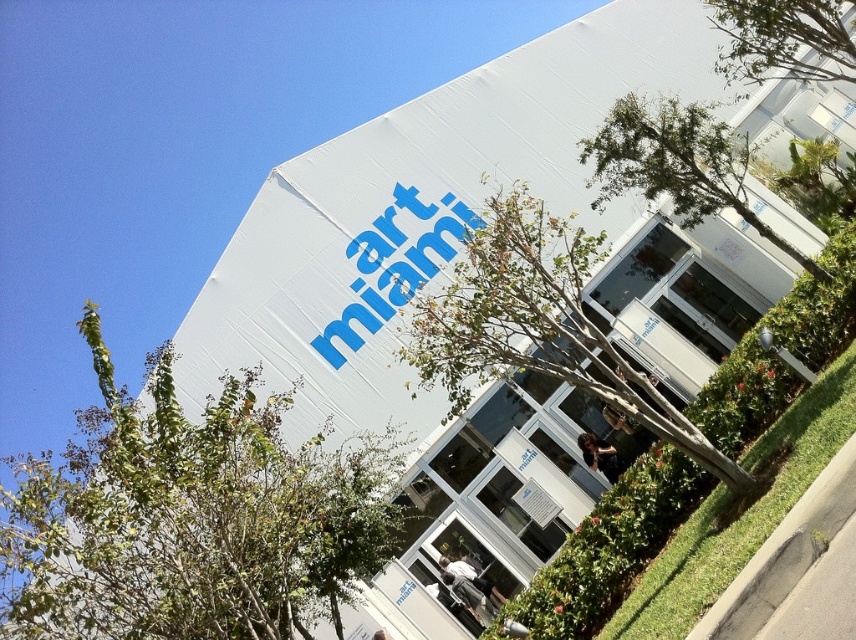
You are standing in front of the Art Miami building and want to take a photo of the point marked at coordinates point [684,214]. If your camera has a maximum focus range of 10 meters, will you be able to capture the point clearly?

The point [684,214] is 11.23 meters from the camera, which exceeds the maximum focus range of 10 meters. Therefore, you will not be able to capture the point clearly.

You are standing in front of the art miami building and see the green leafy tree at upper left and the green leafy tree at upper right. Which tree is located to the left of the other?

The green leafy tree at upper left is positioned to the left of the green leafy tree at upper right.

You are a delivery person with a cart that is 6 feet wide. You need to move from the transparent glass door at center to the green leafy tree at center. Is there enough space between them for your cart to pass through?

The distance between the transparent glass door at center and the green leafy tree at center is 7.27 feet, which is wider than the cart width of 6 feet. Therefore, the cart can pass through the space between them.